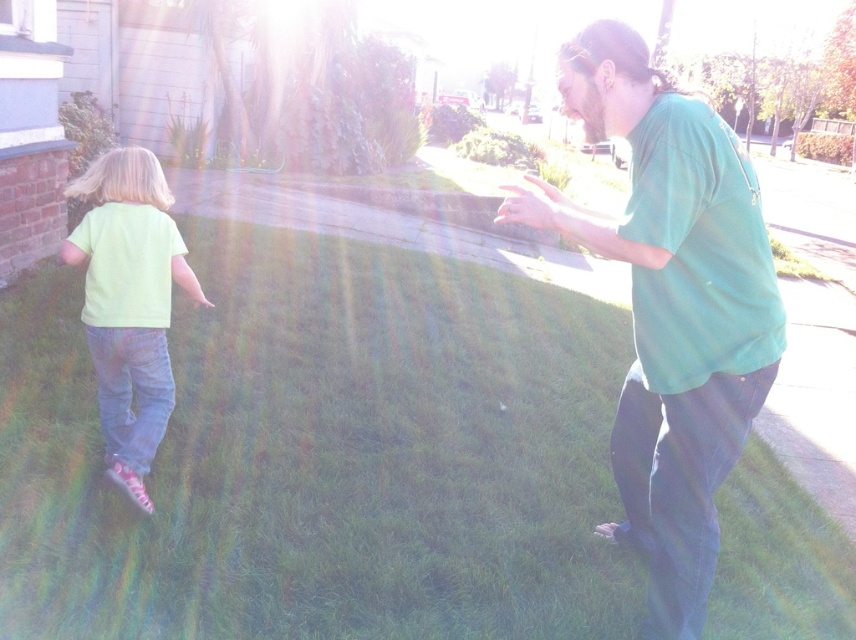
You are standing at the point labeled as point (348, 621) in the image. A friend is holding a ball 2 meters away from you. Can you throw the ball to your friend without moving from your current position?

The distance between you and your friend is 2 meters, which is less than the 2.38 meters between the point (348, 621) and the viewer. Since you can reach your friend within that distance, yes, you can throw the ball to your friend without moving.